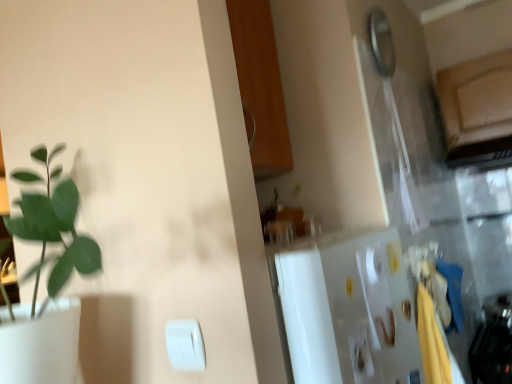
Question: Which direction should I rotate to look at white plastic light switch at lower center, which is the second light switch from left to right?

Choices:
 (A) right
 (B) left

Answer: (A)

Question: In which direction should I rotate to look at white plastic light switch at lower center, placed as the 1th light switch when sorted from left to right?

Choices:
 (A) right
 (B) left

Answer: (B)

Question: From a real-world perspective, is white plastic light switch at lower center, which is counted as the 2th light switch, starting from the back, positioned over white plastic light switch at lower center, marked as the 1th light switch in a back-to-front arrangement, based on gravity?

Choices:
 (A) no
 (B) yes

Answer: (B)

Question: From a real-world perspective, is white plastic light switch at lower center, placed as the second light switch when sorted from right to left, physically below white plastic light switch at lower center, the second light switch positioned from the front?

Choices:
 (A) no
 (B) yes

Answer: (A)

Question: Is white plastic light switch at lower center, marked as the first light switch in a front-to-back arrangement, completely or partially outside of white plastic light switch at lower center, the 1th light switch in the right-to-left sequence?

Choices:
 (A) no
 (B) yes

Answer: (B)

Question: Is white plastic light switch at lower center, placed as the 1th light switch when sorted from left to right, positioned behind white plastic light switch at lower center, marked as the 1th light switch in a back-to-front arrangement?

Choices:
 (A) no
 (B) yes

Answer: (A)

Question: From the image's perspective, is white plastic light switch at lower center, which is counted as the 2th light switch, starting from the back, above white plastic light switch at lower center, which is the second light switch from left to right?

Choices:
 (A) no
 (B) yes

Answer: (B)

Question: Is white plastic light switch at lower center, which is counted as the 2th light switch, starting from the back, in contact with white plastic light switch at lower center, the 1th light switch in the right-to-left sequence?

Choices:
 (A) no
 (B) yes

Answer: (A)

Question: Is white plastic light switch at lower center, which is the second light switch from left to right, taller than white plastic light switch at lower center, marked as the first light switch in a front-to-back arrangement?

Choices:
 (A) yes
 (B) no

Answer: (A)

Question: Is white plastic light switch at lower center, marked as the 1th light switch in a back-to-front arrangement, to the left of white plastic light switch at lower center, which is counted as the 2th light switch, starting from the back, from the viewer's perspective?

Choices:
 (A) no
 (B) yes

Answer: (A)

Question: Would you consider white plastic light switch at lower center, the 1th light switch in the right-to-left sequence, to be distant from white plastic light switch at lower center, which is counted as the 2th light switch, starting from the back?

Choices:
 (A) no
 (B) yes

Answer: (A)

Question: From a real-world perspective, is white plastic light switch at lower center, marked as the 1th light switch in a back-to-front arrangement, under white plastic light switch at lower center, marked as the first light switch in a front-to-back arrangement?

Choices:
 (A) no
 (B) yes

Answer: (B)

Question: Is white plastic light switch at lower center, marked as the 1th light switch in a back-to-front arrangement, turned away from white plastic light switch at lower center, placed as the second light switch when sorted from right to left?

Choices:
 (A) yes
 (B) no

Answer: (B)

Question: Are white plastic light switch at lower center, the second light switch positioned from the front, and white plastic light switch at lower center, placed as the 1th light switch when sorted from left to right, making contact?

Choices:
 (A) yes
 (B) no

Answer: (B)

Question: Looking at their shapes, would you say white plastic light switch at lower center, placed as the second light switch when sorted from right to left, is wider or thinner than white plastic light switch at lower center, the second light switch positioned from the front?

Choices:
 (A) thin
 (B) wide

Answer: (A)